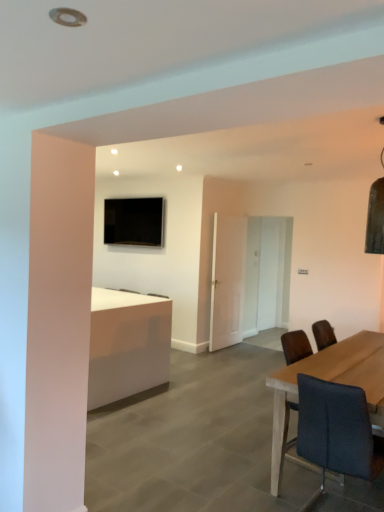
The image size is (384, 512). I want to click on transparent glass door at center, positioned as the first glass door in left-to-right order, so click(x=227, y=280).

Locate an element on the screen. white glossy desk at center is located at coordinates (127, 345).

Locate an element on the screen. Image resolution: width=384 pixels, height=512 pixels. black glossy tv at upper center is located at coordinates (133, 221).

The height and width of the screenshot is (512, 384). Find the location of `transparent glass door at center, positioned as the second glass door in right-to-left order`. transparent glass door at center, positioned as the second glass door in right-to-left order is located at coordinates (227, 280).

Considering the positions of objects transparent glass door at center, positioned as the first glass door in left-to-right order, and white glossy desk at center in the image provided, who is more to the left, transparent glass door at center, positioned as the first glass door in left-to-right order, or white glossy desk at center?

Positioned to the left is white glossy desk at center.

From a real-world perspective, which is physically below, transparent glass door at center, positioned as the second glass door in right-to-left order, or white glossy desk at center?

white glossy desk at center, from a real-world perspective.

Identify the location of desk that appears below the transparent glass door at center, positioned as the second glass door in right-to-left order (from the image's perspective). (127, 345).

From the picture: Which is correct: transparent glass door at center, positioned as the first glass door in left-to-right order, is inside white glossy desk at center, or outside of it?

transparent glass door at center, positioned as the first glass door in left-to-right order, is located beyond the bounds of white glossy desk at center.

What's the angular difference between white glossy desk at center and white glossy door at center, the 1th glass door in the right-to-left sequence,'s facing directions?

86.3 degrees.

Could you measure the distance between white glossy desk at center and white glossy door at center, which ranks as the second glass door in left-to-right order?

white glossy desk at center and white glossy door at center, which ranks as the second glass door in left-to-right order, are 7.47 feet apart from each other.

In the image, is white glossy desk at center on the left side or the right side of white glossy door at center, the 1th glass door in the right-to-left sequence?

Clearly, white glossy desk at center is on the left of white glossy door at center, the 1th glass door in the right-to-left sequence, in the image.

Does point (167, 359) appear closer or farther from the camera than point (276, 234)?

Point (167, 359) appears to be closer to the viewer than point (276, 234).

Is transparent glass door at center, positioned as the first glass door in left-to-right order, next to white glossy door at center, the 1th glass door in the right-to-left sequence?

They are not placed beside each other.

Is transparent glass door at center, positioned as the first glass door in left-to-right order, wider than white glossy door at center, which ranks as the second glass door in left-to-right order?

Incorrect, the width of transparent glass door at center, positioned as the first glass door in left-to-right order, does not surpass that of white glossy door at center, which ranks as the second glass door in left-to-right order.

Looking at the image, does transparent glass door at center, positioned as the second glass door in right-to-left order, seem bigger or smaller compared to white glossy door at center, the 1th glass door in the right-to-left sequence?

Clearly, transparent glass door at center, positioned as the second glass door in right-to-left order, is smaller in size than white glossy door at center, the 1th glass door in the right-to-left sequence.

Considering the sizes of objects transparent glass door at center, positioned as the second glass door in right-to-left order, and white glossy door at center, the 1th glass door in the right-to-left sequence, in the image provided, who is taller, transparent glass door at center, positioned as the second glass door in right-to-left order, or white glossy door at center, the 1th glass door in the right-to-left sequence,?

Standing taller between the two is white glossy door at center, the 1th glass door in the right-to-left sequence.

Are white glossy desk at center and dark gray fabric chair at right beside each other?

No, white glossy desk at center is not making contact with dark gray fabric chair at right.

Where is `desk behind the dark gray fabric chair at right`? desk behind the dark gray fabric chair at right is located at coordinates (127, 345).

Is white glossy desk at center outside of dark gray fabric chair at right?

That's correct, white glossy desk at center is outside of dark gray fabric chair at right.

Can you confirm if white glossy desk at center is wider than dark gray fabric chair at right?

Correct, the width of white glossy desk at center exceeds that of dark gray fabric chair at right.

Considering the relative sizes of black glossy tv at upper center and dark gray fabric chair at right in the image provided, is black glossy tv at upper center taller than dark gray fabric chair at right?

No, black glossy tv at upper center is not taller than dark gray fabric chair at right.

Considering the sizes of objects black glossy tv at upper center and dark gray fabric chair at right in the image provided, who is wider, black glossy tv at upper center or dark gray fabric chair at right?

dark gray fabric chair at right.

Is black glossy tv at upper center in front of dark gray fabric chair at right?

No.

Considering the relative positions of black glossy tv at upper center and dark gray fabric chair at right in the image provided, is black glossy tv at upper center to the left or to the right of dark gray fabric chair at right?

In the image, black glossy tv at upper center appears on the left side of dark gray fabric chair at right.

Could black glossy tv at upper center be considered to be inside white glossy desk at center?

No, black glossy tv at upper center is not surrounded by white glossy desk at center.

From the image's perspective, between white glossy desk at center and black glossy tv at upper center, which one is located above?

black glossy tv at upper center appears higher in the image.

Relative to black glossy tv at upper center, is white glossy desk at center in front or behind?

Visually, white glossy desk at center is located in front of black glossy tv at upper center.

Is white glossy desk at center placed right next to black glossy tv at upper center?

white glossy desk at center and black glossy tv at upper center are not in contact.

Considering the relative sizes of dark gray fabric chair at right and white glossy desk at center in the image provided, is dark gray fabric chair at right shorter than white glossy desk at center?

Yes.

Is dark gray fabric chair at right directly adjacent to white glossy desk at center?

No, dark gray fabric chair at right is not making contact with white glossy desk at center.

Can you tell me how much dark gray fabric chair at right and white glossy desk at center differ in facing direction?

The angle between the facing direction of dark gray fabric chair at right and the facing direction of white glossy desk at center is 90.4 degrees.

Find the location of `desk on the left of transparent glass door at center, positioned as the first glass door in left-to-right order`. desk on the left of transparent glass door at center, positioned as the first glass door in left-to-right order is located at coordinates (127, 345).

In order to click on the 2nd glass door above the white glossy desk at center (from a real-world perspective) in this screenshot , I will do `click(266, 274)`.

From the image, which object appears to be nearer to black glossy tv at upper center, transparent glass door at center, positioned as the second glass door in right-to-left order, or dark gray fabric chair at right?

Among the two, transparent glass door at center, positioned as the second glass door in right-to-left order, is located nearer to black glossy tv at upper center.

From the image, which object appears to be farther from white glossy desk at center, transparent glass door at center, positioned as the second glass door in right-to-left order, or white glossy door at center, which ranks as the second glass door in left-to-right order?

The object further to white glossy desk at center is white glossy door at center, which ranks as the second glass door in left-to-right order.

Based on their spatial positions, is white glossy door at center, which ranks as the second glass door in left-to-right order, or black glossy tv at upper center further from white glossy desk at center?

white glossy door at center, which ranks as the second glass door in left-to-right order.

When comparing their distances from white glossy desk at center, does black glossy tv at upper center or transparent glass door at center, positioned as the second glass door in right-to-left order, seem closer?

Among the two, transparent glass door at center, positioned as the second glass door in right-to-left order, is located nearer to white glossy desk at center.

Considering their positions, is white glossy desk at center positioned closer to white glossy door at center, the 1th glass door in the right-to-left sequence, than black glossy tv at upper center?

The object closer to white glossy door at center, the 1th glass door in the right-to-left sequence, is black glossy tv at upper center.

Considering their positions, is transparent glass door at center, positioned as the first glass door in left-to-right order, positioned further to white glossy desk at center than dark gray fabric chair at right?

The object further to white glossy desk at center is dark gray fabric chair at right.

From the picture: Which object lies further to the anchor point transparent glass door at center, positioned as the second glass door in right-to-left order, white glossy desk at center or black glossy tv at upper center?

white glossy desk at center.

Considering their positions, is black glossy tv at upper center positioned closer to dark gray fabric chair at right than white glossy door at center, which ranks as the second glass door in left-to-right order?

Based on the image, black glossy tv at upper center appears to be nearer to dark gray fabric chair at right.

Identify the location of glass door between dark gray fabric chair at right and white glossy door at center, which ranks as the second glass door in left-to-right order, from front to back. (227, 280).

Find the location of a particular element. This screenshot has width=384, height=512. desk between dark gray fabric chair at right and black glossy tv at upper center from front to back is located at coordinates (127, 345).

Find the location of a particular element. This screenshot has height=512, width=384. glass door between black glossy tv at upper center and white glossy door at center, the 1th glass door in the right-to-left sequence is located at coordinates [x=227, y=280].

Find the location of `glass door positioned between white glossy desk at center and white glossy door at center, the 1th glass door in the right-to-left sequence, from near to far`. glass door positioned between white glossy desk at center and white glossy door at center, the 1th glass door in the right-to-left sequence, from near to far is located at coordinates (227, 280).